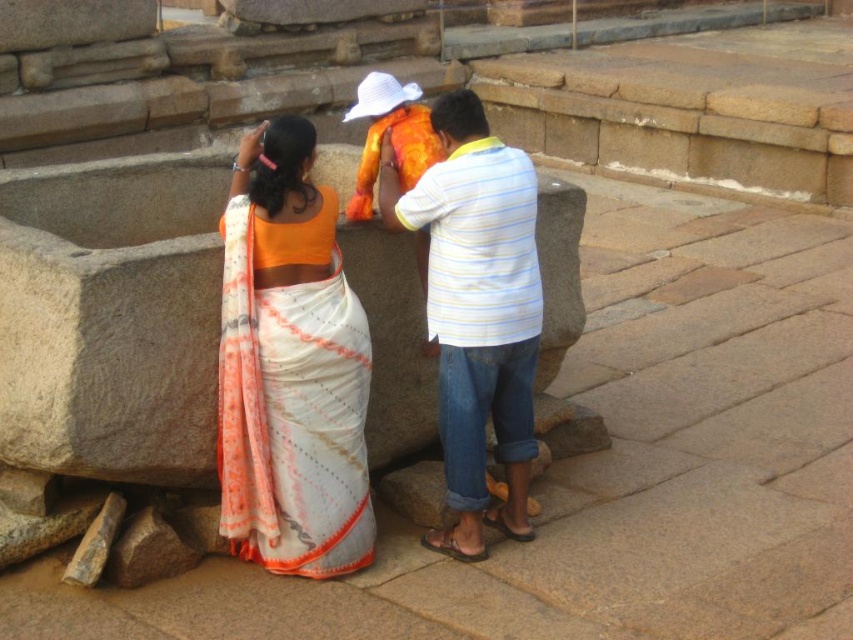
You are a photographer standing at the back of the scene. You want to capture a photo where both the orange cotton saree at center and the white striped shirt at center are in focus. Given that your camera can only focus on objects within a 25 inch range, will you be able to capture both in focus?

The orange cotton saree at center and white striped shirt at center are 25.42 inches apart from each other. Since the camera can only focus within a 25 inch range, the distance between them exceeds this limit. Therefore, you cannot capture both in focus simultaneously.

You are a photographer planning to take a group photo of the orange cotton saree at center and the white striped shirt at center. Which of the two will you need to position closer to the camera to ensure they both appear the same size in the photo?

The orange cotton saree at center occupies less space than the white striped shirt at center, so you should position the orange cotton saree at center closer to the camera to make them appear the same size.

You are standing in front of the ancient stone structure and see the white silk saree at center and the white striped shirt at center. Which one is closer to you?

The white silk saree at center is closer to you because it is in front of the white striped shirt at center.